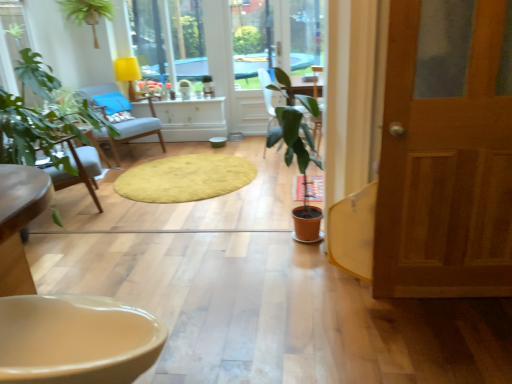
Consider the image. Measure the distance between point (131, 94) and camera.

They are 5.21 meters apart.

Describe the element at coordinates (446, 152) in the screenshot. I see `wooden door at right` at that location.

Measure the distance between point (79, 90) and camera.

They are 3.17 meters apart.

Identify the location of yellow soft rug at center. (185, 178).

Is wooden door at right a part of green matte plant at center, the second houseplant positioned from the top?

Actually, wooden door at right is outside green matte plant at center, the second houseplant positioned from the top.

Is green matte plant at center, the second houseplant positioned from the top, oriented towards wooden door at right?

No.

Identify the location of door above the green matte plant at center, acting as the first houseplant starting from the right (from a real-world perspective). The image size is (512, 384). (446, 152).

Is green matte plant at center, which is counted as the second houseplant, starting from the back, further to camera compared to wooden door at right?

Yes, green matte plant at center, which is counted as the second houseplant, starting from the back, is behind wooden door at right.

How many degrees apart are the facing directions of yellow soft rug at center and light blue fabric chair at center?

53.9 degrees separate the facing orientations of yellow soft rug at center and light blue fabric chair at center.

Based on the photo, relative to light blue fabric chair at center, is yellow soft rug at center in front or behind?

In the image, yellow soft rug at center appears in front of light blue fabric chair at center.

Does yellow soft rug at center have a smaller size compared to light blue fabric chair at center?

Yes.

Is yellow soft rug at center far away from light blue fabric chair at center?

They are positioned close to each other.

Is light blue fabric chair at center positioned with its back to green matte plant at upper left, acting as the first houseplant starting from the left?

light blue fabric chair at center does not have its back to green matte plant at upper left, acting as the first houseplant starting from the left.

From a real-world perspective, which houseplant is the 2nd one above the light blue fabric chair at center? Please provide its 2D coordinates.

[(87, 13)]

From the image's perspective, is light blue fabric chair at center located beneath green matte plant at upper left, the first houseplant positioned from the top?

Yes.

Visually, is light blue fabric chair at center positioned to the left or to the right of green matte plant at upper left, the 2th houseplant from the front?

light blue fabric chair at center is to the right of green matte plant at upper left, the 2th houseplant from the front.

From the image's perspective, would you say yellow soft rug at center is shown under green matte plant at center, which is counted as the second houseplant, starting from the back?

Correct, yellow soft rug at center appears lower than green matte plant at center, which is counted as the second houseplant, starting from the back, in the image.

Can you confirm if yellow soft rug at center is positioned to the right of green matte plant at center, which is counted as the second houseplant, starting from the back?

No.

Is yellow soft rug at center smaller than green matte plant at center, the first houseplant when ordered from front to back?

Correct, yellow soft rug at center occupies less space than green matte plant at center, the first houseplant when ordered from front to back.

In the scene shown: Considering the relative sizes of light blue fabric chair at center and yellow soft rug at center in the image provided, is light blue fabric chair at center smaller than yellow soft rug at center?

Incorrect, light blue fabric chair at center is not smaller in size than yellow soft rug at center.

Considering the sizes of objects light blue fabric chair at center and yellow soft rug at center in the image provided, who is taller, light blue fabric chair at center or yellow soft rug at center?

light blue fabric chair at center.

In the image, is light blue fabric chair at center on the left side or the right side of yellow soft rug at center?

Based on their positions, light blue fabric chair at center is located to the left of yellow soft rug at center.

Based on the photo, what's the angular difference between light blue fabric chair at center and yellow soft rug at center's facing directions?

They differ by 53.9 degrees in their facing directions.

Is green matte plant at upper left, the first houseplant positioned from the top, not inside light blue fabric chair at center?

green matte plant at upper left, the first houseplant positioned from the top, lies outside light blue fabric chair at center's area.

From a real-world perspective, which object stands above the other?

green matte plant at upper left, the first houseplant positioned from the top, is physically above.

Looking at this image, can you see green matte plant at upper left, the second houseplant from the right, touching light blue fabric chair at center?

green matte plant at upper left, the second houseplant from the right, is not next to light blue fabric chair at center, and they're not touching.

From the image's perspective, is green matte plant at upper left, acting as the first houseplant starting from the left, on light blue fabric chair at center?

Indeed, from the image's perspective, green matte plant at upper left, acting as the first houseplant starting from the left, is shown above light blue fabric chair at center.

From the image's perspective, is green matte plant at center, which is counted as the first houseplant, starting from the bottom, above or below green matte plant at upper left, the first houseplant positioned from the top?

Clearly, from the image's perspective, green matte plant at center, which is counted as the first houseplant, starting from the bottom, is below green matte plant at upper left, the first houseplant positioned from the top.

In terms of height, does green matte plant at center, acting as the first houseplant starting from the right, look taller or shorter compared to green matte plant at upper left, acting as the first houseplant starting from the left?

green matte plant at center, acting as the first houseplant starting from the right, is taller than green matte plant at upper left, acting as the first houseplant starting from the left.

Identify the location of houseplant above the green matte plant at center, which is counted as the first houseplant, starting from the bottom (from a real-world perspective). (87, 13).

Is green matte plant at center, which is counted as the second houseplant, starting from the back, oriented away from green matte plant at upper left, the second houseplant from the right?

green matte plant at center, which is counted as the second houseplant, starting from the back, does not have its back to green matte plant at upper left, the second houseplant from the right.

Where is `the 1st houseplant behind the wooden door at right`? The width and height of the screenshot is (512, 384). the 1st houseplant behind the wooden door at right is located at coordinates (298, 168).

You are a GUI agent. You are given a task and a screenshot of the screen. Output one action in this format:
    pyautogui.click(x=<x>, y=<y>)
    Task: Click on the chair that appears above the yellow soft rug at center (from the image's perspective)
    
    Given the screenshot: What is the action you would take?
    pyautogui.click(x=138, y=130)

From the picture: Which object lies nearer to the anchor point yellow soft rug at center, wooden door at right or yellow fabric lampshade at upper center?

The object closer to yellow soft rug at center is yellow fabric lampshade at upper center.

When comparing their distances from light blue fabric chair at center, does green matte plant at upper left, acting as the first houseplant starting from the left, or wooden door at right seem further?

wooden door at right lies further to light blue fabric chair at center than the other object.

From the image, which object appears to be farther from light blue fabric chair at center, beige glossy sink at lower left or yellow fabric lampshade at upper center?

Among the two, beige glossy sink at lower left is located further to light blue fabric chair at center.

From the image, which object appears to be farther from green matte plant at center, the first houseplant when ordered from front to back, yellow soft rug at center or beige glossy sink at lower left?

Among the two, beige glossy sink at lower left is located further to green matte plant at center, the first houseplant when ordered from front to back.

Looking at the image, which one is located further to wooden door at right, light blue fabric chair at center or yellow fabric lampshade at upper center?

Based on the image, yellow fabric lampshade at upper center appears to be further to wooden door at right.

Which object lies further to the anchor point green matte plant at center, which is counted as the second houseplant, starting from the back, beige glossy sink at lower left or green matte plant at upper left, acting as the first houseplant starting from the left?

green matte plant at upper left, acting as the first houseplant starting from the left, is positioned further to the anchor green matte plant at center, which is counted as the second houseplant, starting from the back.

When comparing their distances from wooden door at right, does light blue fabric chair at center or green matte plant at upper left, the second houseplant from the right, seem further?

green matte plant at upper left, the second houseplant from the right, lies further to wooden door at right than the other object.

Based on their spatial positions, is wooden door at right or green matte plant at upper left, acting as the first houseplant starting from the left, closer to yellow soft rug at center?

Among the two, wooden door at right is located nearer to yellow soft rug at center.

Where is `chair positioned between yellow soft rug at center and yellow fabric lampshade at upper center from near to far`? The image size is (512, 384). chair positioned between yellow soft rug at center and yellow fabric lampshade at upper center from near to far is located at coordinates pos(138,130).

Find the location of a particular element. Image resolution: width=512 pixels, height=384 pixels. mat between beige glossy sink at lower left and yellow fabric lampshade at upper center in the front-back direction is located at coordinates (185, 178).

You are a GUI agent. You are given a task and a screenshot of the screen. Output one action in this format:
    pyautogui.click(x=<x>, y=<y>)
    Task: Click on the chair positioned between green matte plant at center, which is counted as the second houseplant, starting from the back, and yellow fabric lampshade at upper center from near to far
    The height and width of the screenshot is (384, 512).
    Given the screenshot: What is the action you would take?
    pyautogui.click(x=138, y=130)

Image resolution: width=512 pixels, height=384 pixels. Identify the location of lamp between green matte plant at upper left, acting as the first houseplant starting from the left, and light blue fabric chair at center, in the vertical direction. (128, 73).